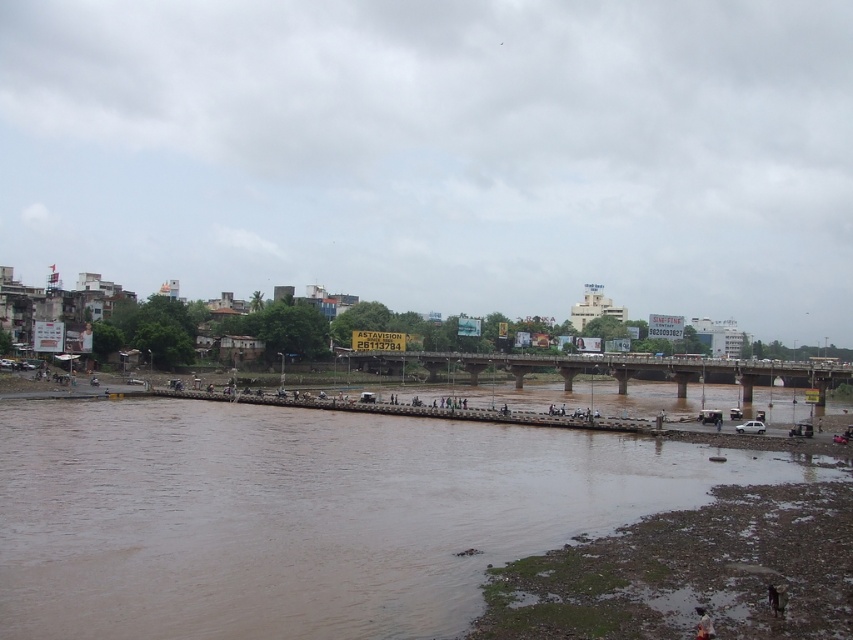
You are standing at the edge of the river and want to reach the muddy sand at lower right. Given that your maximum comfortable walking distance is 80 feet, can you comfortably walk to it without needing to rest?

The muddy sand at lower right is 82.92 feet from viewer, which exceeds your maximum comfortable walking distance of 80 feet. Therefore, you may need to rest during the journey.

You are standing on the riverbank and want to take a photo of the concrete bridge at center. However, the brown muddy water at lower left is blocking your view. Can you move to the right to get a clearer shot of the bridge without the water in the foreground?

The brown muddy water at lower left is closer to the viewer than concrete bridge at center. By moving to the right, you can position yourself so the water is no longer in the foreground, allowing a clearer view of the bridge.